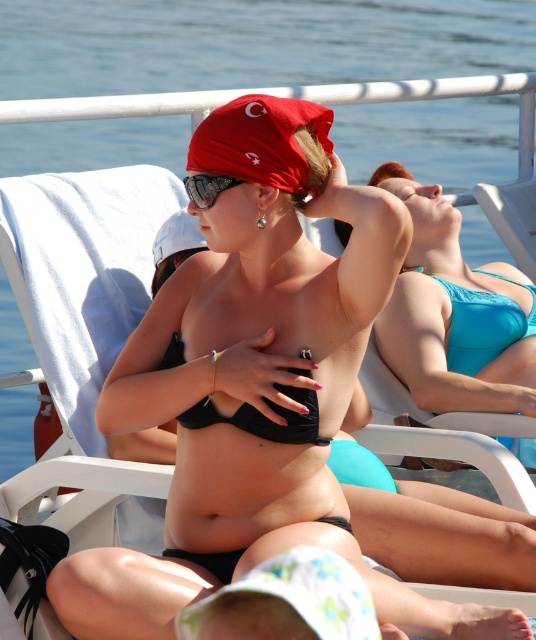
Question: Is turquoise fabric bikini top at upper right above sunglasses at center?

Choices:
 (A) yes
 (B) no

Answer: (B)

Question: Is black matte bikini at center above sunglasses at center?

Choices:
 (A) no
 (B) yes

Answer: (A)

Question: Which object is closer to the camera taking this photo?

Choices:
 (A) sunglasses at center
 (B) black matte bikini at center
 (C) teal matte bikini at upper right
 (D) turquoise fabric bikini top at upper right

Answer: (B)

Question: Is teal matte bikini at upper right above sunglasses at center?

Choices:
 (A) no
 (B) yes

Answer: (A)

Question: Estimate the real-world distances between objects in this image. Which object is closer to the turquoise fabric bikini top at upper right?

Choices:
 (A) sunglasses at center
 (B) black matte bikini at center
 (C) teal matte bikini at upper right

Answer: (C)

Question: Which point appears farthest from the camera in this image?

Choices:
 (A) (440, 225)
 (B) (466, 301)
 (C) (235, 182)
 (D) (175, 348)

Answer: (A)